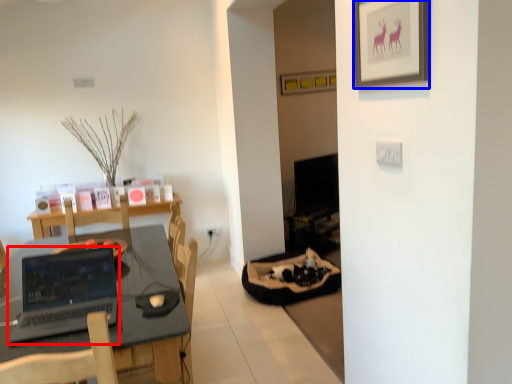
Question: Which of the following is the farthest to the observer, laptop (highlighted by a red box) or picture frame (highlighted by a blue box)?

Choices:
 (A) laptop
 (B) picture frame

Answer: (A)